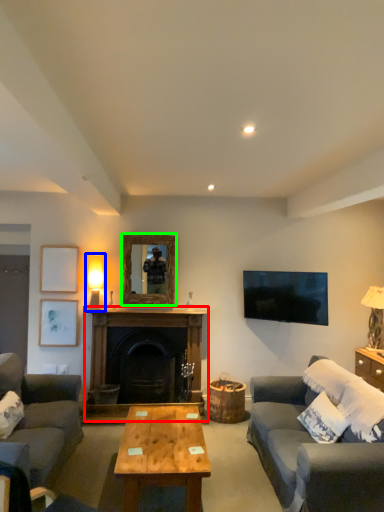
Question: Which object is positioned closest to fireplace (highlighted by a red box)? Select from table lamp (highlighted by a blue box) and mirror (highlighted by a green box).

Choices:
 (A) table lamp
 (B) mirror

Answer: (B)